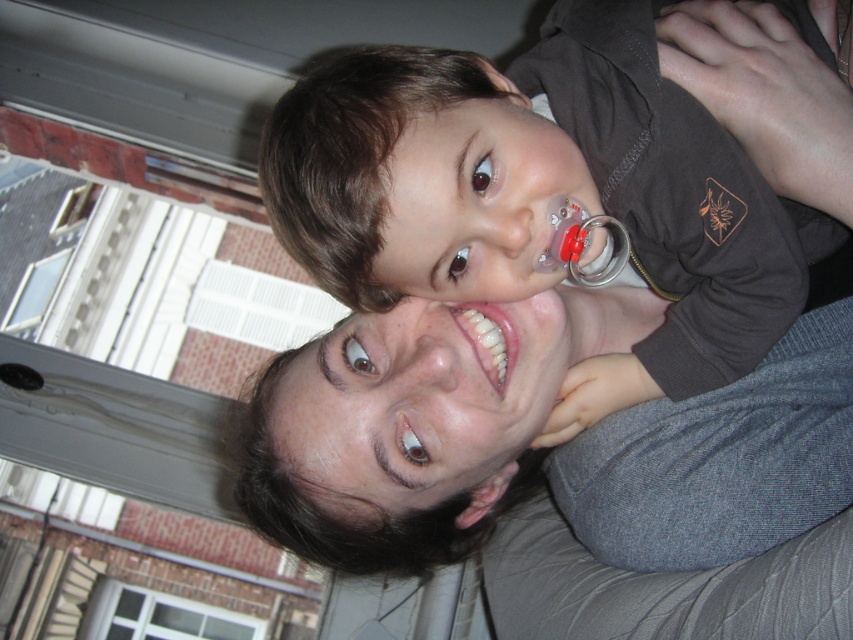
Question: Based on their relative distances, which object is farther from the smooth gray sweater at center?

Choices:
 (A) white glossy teeth at center
 (B) matte brown shirt at upper center

Answer: (A)

Question: Can you confirm if smooth gray sweater at center is bigger than white glossy teeth at center?

Choices:
 (A) yes
 (B) no

Answer: (A)

Question: Which object is positioned closest to the matte brown shirt at upper center?

Choices:
 (A) white glossy teeth at center
 (B) smooth gray sweater at center

Answer: (B)

Question: Does matte brown shirt at upper center have a greater width compared to white glossy teeth at center?

Choices:
 (A) yes
 (B) no

Answer: (A)

Question: Estimate the real-world distances between objects in this image. Which object is closer to the smooth gray sweater at center?

Choices:
 (A) white glossy teeth at center
 (B) matte brown shirt at upper center

Answer: (B)

Question: Does matte brown shirt at upper center have a lesser width compared to white glossy teeth at center?

Choices:
 (A) yes
 (B) no

Answer: (B)